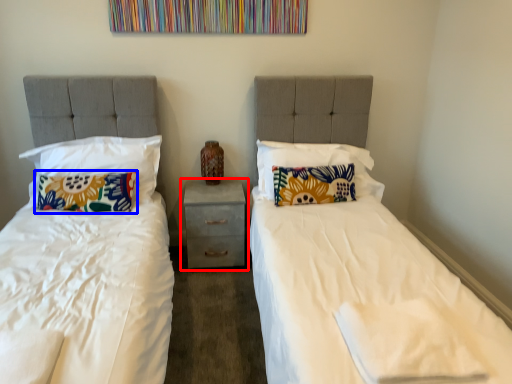
Question: Among these objects, which one is farthest to the camera, nightstand (highlighted by a red box) or pillow (highlighted by a blue box)?

Choices:
 (A) nightstand
 (B) pillow

Answer: (A)